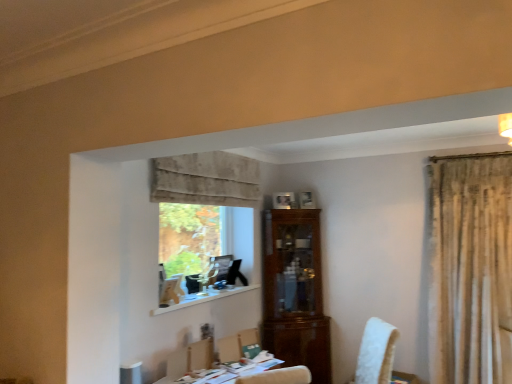
Locate an element on the screen. This screenshot has height=384, width=512. white wood at lower center is located at coordinates (203, 298).

What do you see at coordinates (203, 298) in the screenshot? This screenshot has width=512, height=384. I see `white wood at lower center` at bounding box center [203, 298].

The height and width of the screenshot is (384, 512). What are the coordinates of `clear glass window at center` in the screenshot? It's located at (188, 237).

The height and width of the screenshot is (384, 512). In order to click on white glossy table at lower center in this screenshot , I will do click(210, 370).

Where is `white wood at lower center`? The image size is (512, 384). white wood at lower center is located at coordinates (203, 298).

Is white wood at lower center situated inside clear glass window at center or outside?

white wood at lower center cannot be found inside clear glass window at center.

Would you say white wood at lower center is to the left or to the right of clear glass window at center in the picture?

Clearly, white wood at lower center is on the right of clear glass window at center in the image.

From a real-world perspective, is white wood at lower center below clear glass window at center?

Yes, from a real-world perspective, white wood at lower center is under clear glass window at center.

Does white glossy table at lower center have a lesser width compared to beige velvet curtain at upper center?

In fact, white glossy table at lower center might be wider than beige velvet curtain at upper center.

Is white glossy table at lower center not near beige velvet curtain at upper center?

Yes, white glossy table at lower center and beige velvet curtain at upper center are located far from each other.

In the scene shown: Is white glossy table at lower center not inside beige velvet curtain at upper center?

Yes.

From the image's perspective, is white glossy table at lower center located above or below beige velvet curtain at upper center?

Based on their image positions, white glossy table at lower center is located beneath beige velvet curtain at upper center.

Which of these two, light brown wooden armchair at lower center or white wood at lower center, is bigger?

white wood at lower center.

Is light brown wooden armchair at lower center located outside white wood at lower center?

light brown wooden armchair at lower center lies outside white wood at lower center's area.

Considering their positions, is clear glass window at center located in front of or behind white glossy table at lower center?

clear glass window at center is positioned farther from the viewer than white glossy table at lower center.

From the picture: In terms of size, does clear glass window at center appear bigger or smaller than white glossy table at lower center?

In the image, clear glass window at center appears to be smaller than white glossy table at lower center.

This screenshot has width=512, height=384. Find the location of `window screen on the left of white glossy table at lower center`. window screen on the left of white glossy table at lower center is located at coordinates (188, 237).

Can you confirm if clear glass window at center is wider than white glossy table at lower center?

No.

Is clear glass window at center taller than green fabric chair at center?

Correct, clear glass window at center is much taller as green fabric chair at center.

From the image's perspective, is clear glass window at center positioned above or below green fabric chair at center?

clear glass window at center is above green fabric chair at center.

Based on the photo, what's the angular difference between clear glass window at center and green fabric chair at center's facing directions?

The facing directions of clear glass window at center and green fabric chair at center are 17.4 degrees apart.

Does clear glass window at center appear on the right side of green fabric chair at center?

Incorrect, clear glass window at center is not on the right side of green fabric chair at center.

Which of these two, white glossy table at lower center or green fabric chair at center, is wider?

white glossy table at lower center is wider.

From a real-world perspective, is white glossy table at lower center positioned under green fabric chair at center based on gravity?

Correct, in the physical world, white glossy table at lower center is lower than green fabric chair at center.

Between white glossy table at lower center and green fabric chair at center, which one appears on the right side from the viewer's perspective?

green fabric chair at center.

Which is in front, point (203, 203) or point (265, 364)?

Point (265, 364)

Does beige velvet curtain at upper center come behind white glossy table at lower center?

Yes, beige velvet curtain at upper center is further from the viewer.

Is beige velvet curtain at upper center inside or outside of white glossy table at lower center?

beige velvet curtain at upper center is located beyond the bounds of white glossy table at lower center.

Where is `curtain behind the white glossy table at lower center`? The width and height of the screenshot is (512, 384). curtain behind the white glossy table at lower center is located at coordinates (206, 179).

In order to click on window screen behind the white wood at lower center in this screenshot , I will do `click(188, 237)`.

Identify the location of curtain above the white glossy table at lower center (from a real-world perspective). This screenshot has height=384, width=512. (206, 179).

From the image, which object appears to be nearer to white wood at lower center, beige velvet curtain at upper center or light brown wooden armchair at lower center?

light brown wooden armchair at lower center is closer to white wood at lower center.

From the image, which object appears to be farther from white glossy table at lower center, clear glass window at center or green fabric chair at center?

clear glass window at center is positioned further to the anchor white glossy table at lower center.

From the picture: From the image, which object appears to be nearer to clear glass window at center, light brown wooden armchair at lower center or beige velvet curtain at upper center?

The object closer to clear glass window at center is beige velvet curtain at upper center.

When comparing their distances from clear glass window at center, does white wood at lower center or beige velvet curtain at upper center seem further?

Among the two, beige velvet curtain at upper center is located further to clear glass window at center.

When comparing their distances from clear glass window at center, does beige velvet curtain at upper center or light brown wooden armchair at lower center seem closer?

beige velvet curtain at upper center lies closer to clear glass window at center than the other object.

Estimate the real-world distances between objects in this image. Which object is closer to light brown wooden armchair at lower center, white glossy table at lower center or white wood at lower center?

Based on the image, white glossy table at lower center appears to be nearer to light brown wooden armchair at lower center.

Based on the photo, when comparing their distances from green fabric chair at center, does white wood at lower center or beige velvet curtain at upper center seem further?

beige velvet curtain at upper center is positioned further to the anchor green fabric chair at center.

Looking at the image, which one is located closer to beige velvet curtain at upper center, white glossy table at lower center or clear glass window at center?

The object closer to beige velvet curtain at upper center is clear glass window at center.

Find the location of a particular element. This screenshot has height=384, width=512. armchair between beige velvet curtain at upper center and white glossy table at lower center in the vertical direction is located at coordinates (200, 355).

Identify the location of armchair between white glossy table at lower center and clear glass window at center along the z-axis. (200, 355).

Locate an element on the screen. This screenshot has height=384, width=512. armchair between beige velvet curtain at upper center and green fabric chair at center in the up-down direction is located at coordinates (200, 355).

Locate an element on the screen. Image resolution: width=512 pixels, height=384 pixels. window screen that lies between beige velvet curtain at upper center and light brown wooden armchair at lower center from top to bottom is located at coordinates (188, 237).